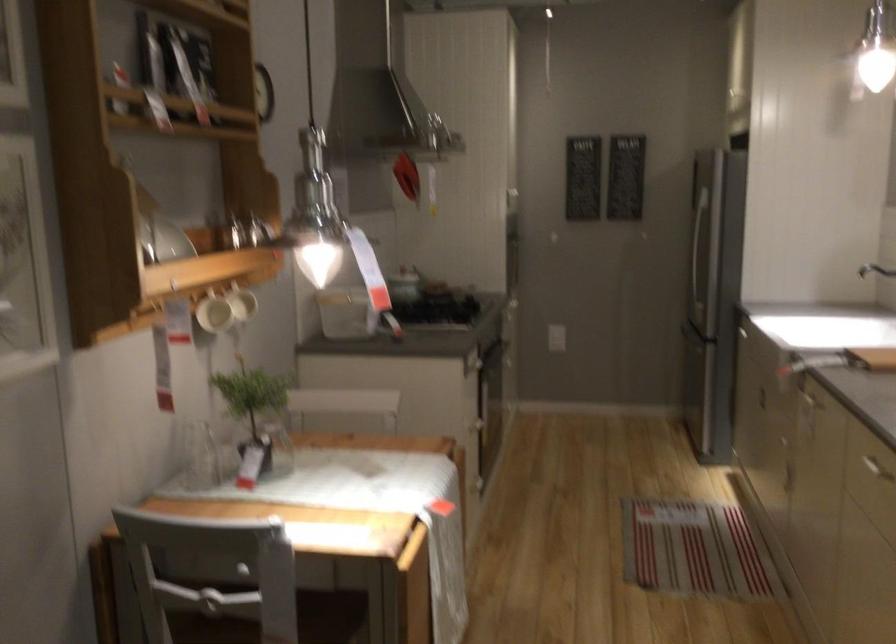
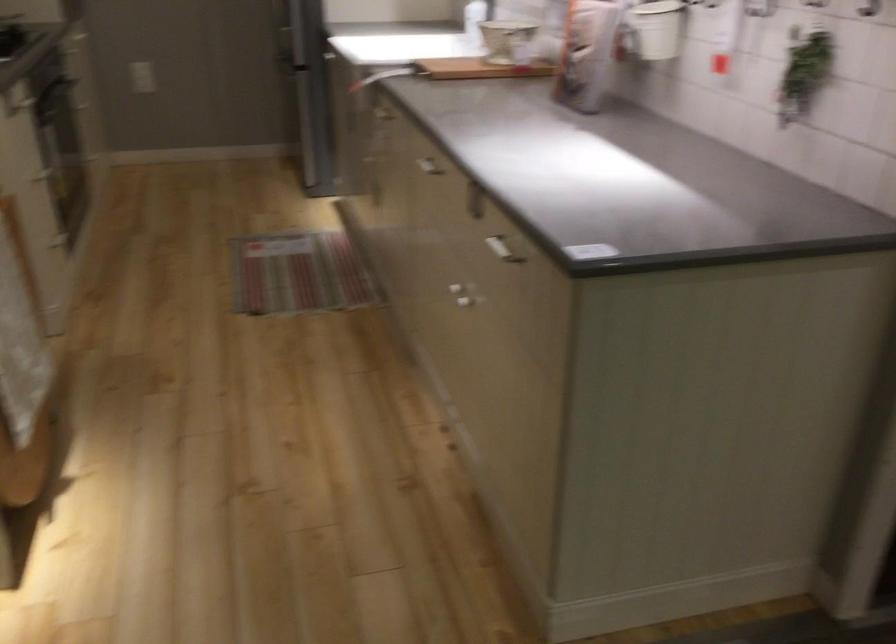
The images are taken continuously from a first-person perspective. In which direction is your viewpoint rotating?

The rotation direction of the camera is right-down.